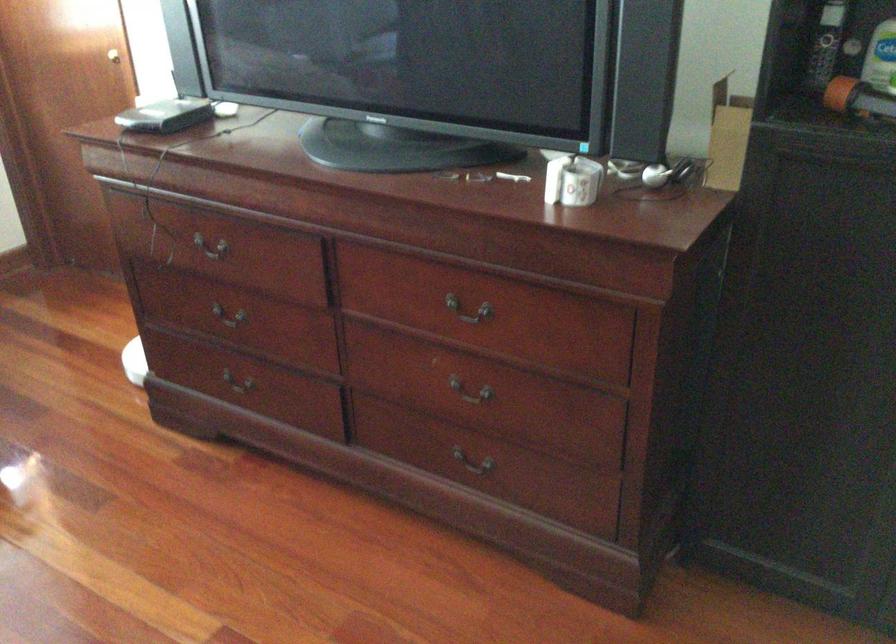
This screenshot has height=644, width=896. I want to click on white tape roll, so click(x=572, y=180).